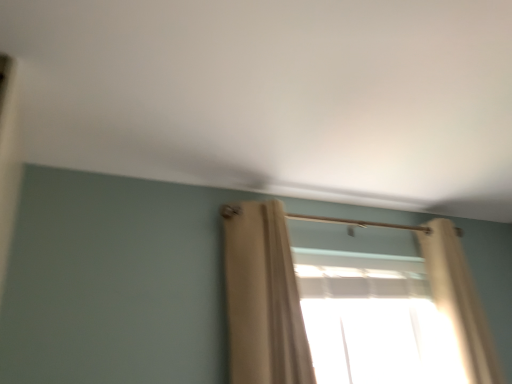
Question: Can you confirm if beige fabric curtain at center, placed as the second curtain when sorted from right to left, is positioned to the right of translucent fabric at center?

Choices:
 (A) no
 (B) yes

Answer: (A)

Question: Is translucent fabric at center located within beige fabric curtain at center, which is the first curtain in left-to-right order?

Choices:
 (A) yes
 (B) no

Answer: (B)

Question: Can you confirm if beige fabric curtain at center, placed as the second curtain when sorted from right to left, is taller than translucent fabric at center?

Choices:
 (A) yes
 (B) no

Answer: (A)

Question: From a real-world perspective, is beige fabric curtain at center, placed as the second curtain when sorted from right to left, under translucent fabric at center?

Choices:
 (A) yes
 (B) no

Answer: (B)

Question: Is beige fabric curtain at center, which is the first curtain in left-to-right order, bigger than translucent fabric at center?

Choices:
 (A) yes
 (B) no

Answer: (B)

Question: Looking at their shapes, would you say beige fabric curtain at center, which is the first curtain in left-to-right order, is wider or thinner than translucent fabric at center?

Choices:
 (A) wide
 (B) thin

Answer: (B)

Question: Considering the positions of point (305, 364) and point (359, 365), is point (305, 364) closer or farther from the camera than point (359, 365)?

Choices:
 (A) closer
 (B) farther

Answer: (A)

Question: From a real-world perspective, relative to translucent fabric at center, is beige fabric curtain at center, placed as the second curtain when sorted from right to left, vertically above or below?

Choices:
 (A) below
 (B) above

Answer: (B)

Question: Considering the positions of beige fabric curtain at center, placed as the second curtain when sorted from right to left, and translucent fabric at center in the image, is beige fabric curtain at center, placed as the second curtain when sorted from right to left, taller or shorter than translucent fabric at center?

Choices:
 (A) tall
 (B) short

Answer: (A)

Question: In the image, is beige sheer curtain at right, the second curtain when ordered from left to right, positioned in front of or behind translucent fabric at center?

Choices:
 (A) front
 (B) behind

Answer: (A)

Question: From the image's perspective, is beige sheer curtain at right, the 1th curtain in the right-to-left sequence, above or below translucent fabric at center?

Choices:
 (A) below
 (B) above

Answer: (B)

Question: Looking at their shapes, would you say beige sheer curtain at right, the 1th curtain in the right-to-left sequence, is wider or thinner than translucent fabric at center?

Choices:
 (A) thin
 (B) wide

Answer: (B)

Question: Is point (468, 377) positioned closer to the camera than point (382, 342)?

Choices:
 (A) farther
 (B) closer

Answer: (B)

Question: Considering the positions of translucent fabric at center and beige fabric curtain at center, which is the first curtain in left-to-right order, in the image, is translucent fabric at center wider or thinner than beige fabric curtain at center, which is the first curtain in left-to-right order,?

Choices:
 (A) wide
 (B) thin

Answer: (A)

Question: Considering the positions of translucent fabric at center and beige fabric curtain at center, which is the first curtain in left-to-right order, in the image, is translucent fabric at center taller or shorter than beige fabric curtain at center, which is the first curtain in left-to-right order,?

Choices:
 (A) short
 (B) tall

Answer: (A)